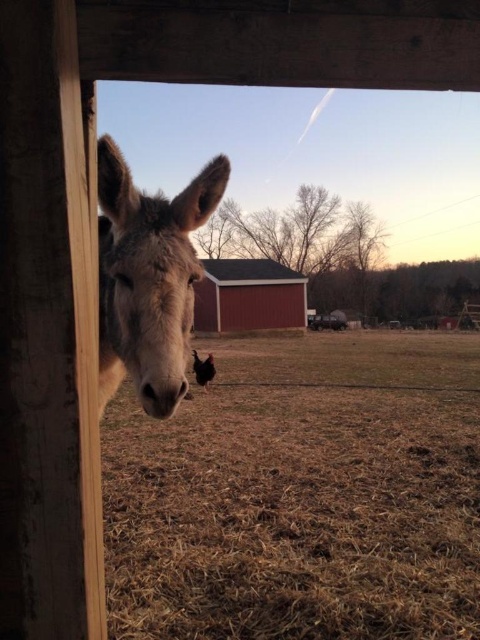
Question: Can you confirm if fuzzy gray mule at left is thinner than red wood barn at center?

Choices:
 (A) yes
 (B) no

Answer: (A)

Question: Which of the following is the closest to the observer?

Choices:
 (A) fuzzy gray mule at left
 (B) red wood barn at center

Answer: (A)

Question: Is fuzzy gray mule at left positioned at the back of red wood barn at center?

Choices:
 (A) yes
 (B) no

Answer: (B)

Question: Does fuzzy gray mule at left lie behind red wood barn at center?

Choices:
 (A) yes
 (B) no

Answer: (B)

Question: Among these points, which one is farthest from the camera?

Choices:
 (A) (156, 410)
 (B) (223, 326)

Answer: (B)